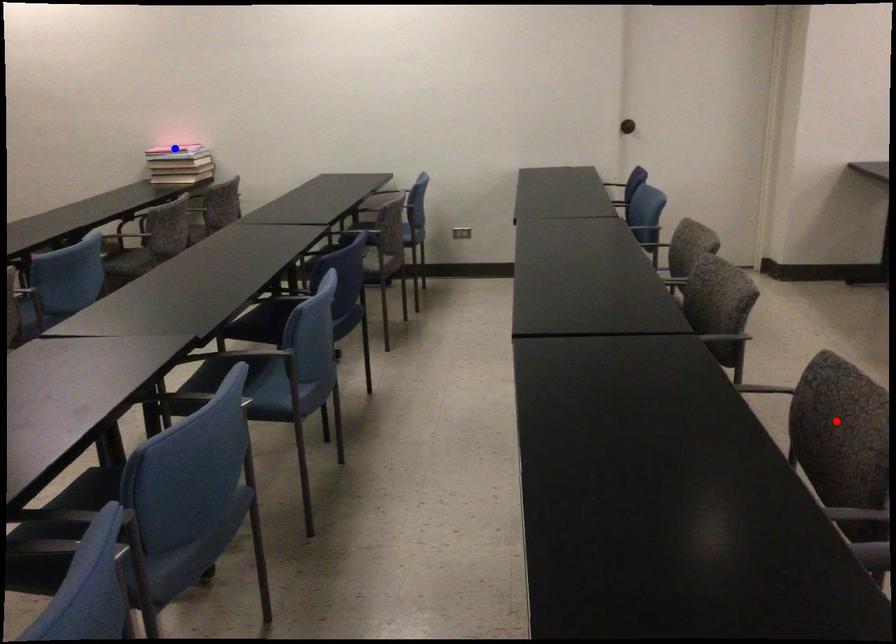
Question: Two points are marked on the image. Which point is closer to the camera?

Choices:
 (A) Blue point is closer.
 (B) Red point is closer.

Answer: (B)